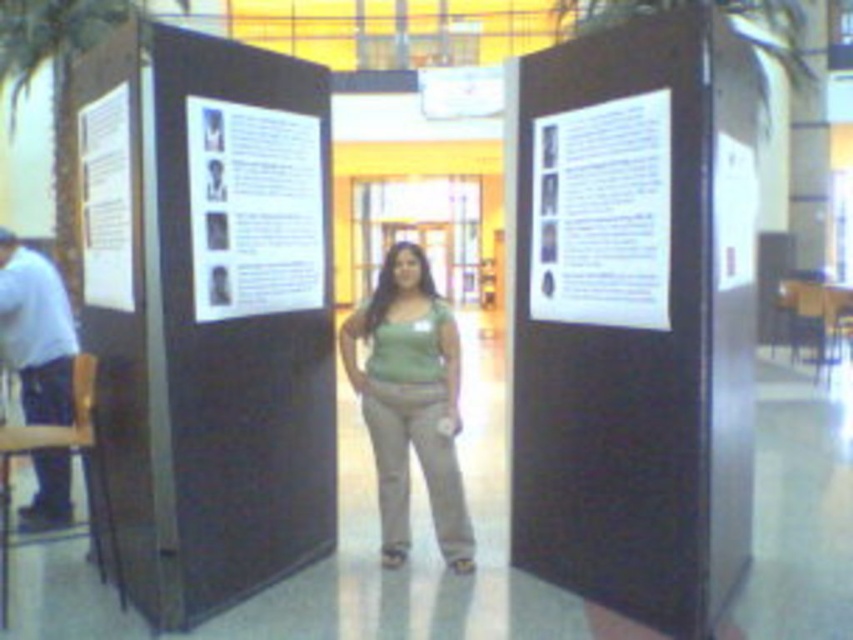
Between white paper at upper center and green matte tank top at center, which one appears on the right side from the viewer's perspective?

From the viewer's perspective, white paper at upper center appears more on the right side.

Is white paper at upper center taller than green matte tank top at center?

Incorrect, white paper at upper center's height is not larger of green matte tank top at center's.

What do you see at coordinates (602, 212) in the screenshot?
I see `white paper at upper center` at bounding box center [602, 212].

The width and height of the screenshot is (853, 640). Identify the location of white paper at upper center. (602, 212).

Image resolution: width=853 pixels, height=640 pixels. Describe the element at coordinates (207, 310) in the screenshot. I see `dark brown wood poster at left` at that location.

Locate an element on the screen. Image resolution: width=853 pixels, height=640 pixels. dark brown wood poster at left is located at coordinates (207, 310).

Which is in front, point (297, 209) or point (51, 426)?

Positioned in front is point (297, 209).

Which of these two, white paper at center or brown leather chair at left, stands taller?

With more height is brown leather chair at left.

Does point (234, 266) lie behind point (123, 608)?

No, it is in front of (123, 608).

Image resolution: width=853 pixels, height=640 pixels. What are the coordinates of `white paper at center` in the screenshot? It's located at (254, 209).